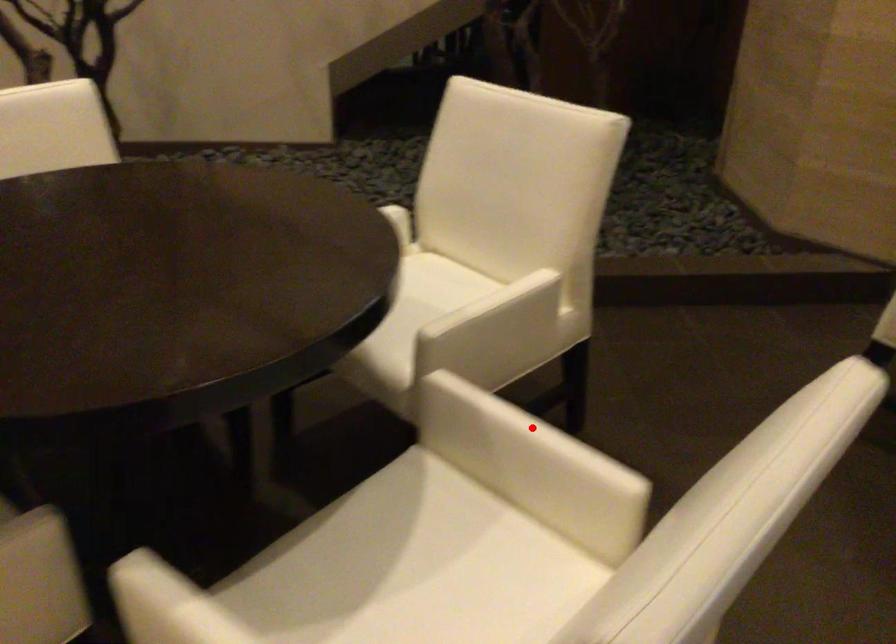
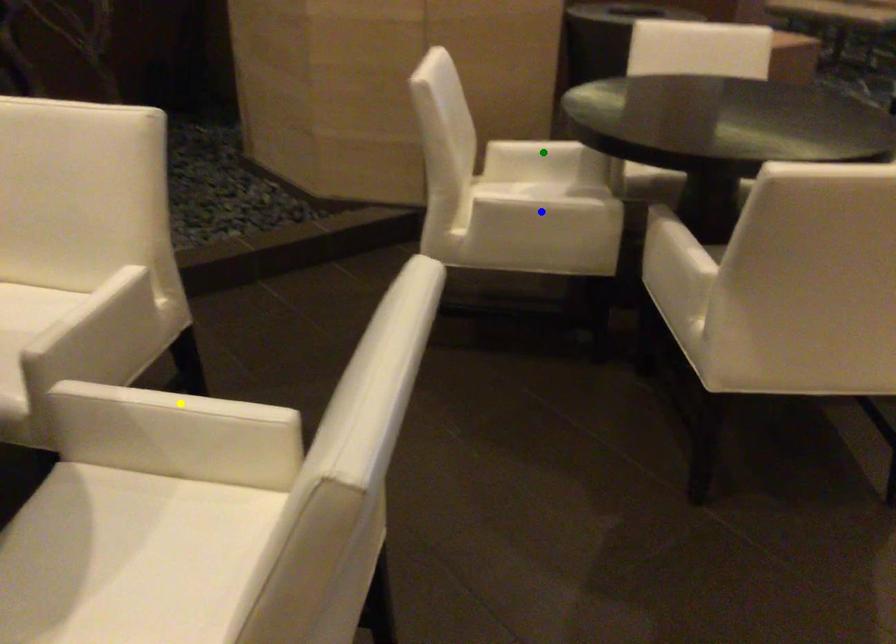
Question: I am providing you with two images of the same scene from different viewpoints. A red point is marked on the first image. You are given multiple points on the second image. Which point in image 2 represents the same 3d spot as the red point in image 1?

Choices:
 (A) yellow point
 (B) green point
 (C) blue point

Answer: (A)